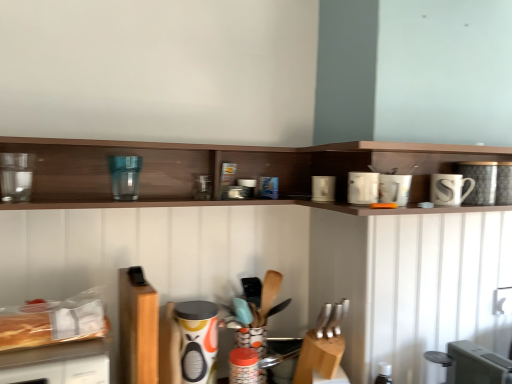
The image size is (512, 384). What do you see at coordinates (248, 186) in the screenshot?
I see `metallic silver toaster at upper center, the 6th appliance when ordered from right to left` at bounding box center [248, 186].

Identify the location of translucent plastic bread at lower left. This screenshot has height=384, width=512. (53, 321).

What do you see at coordinates (53, 321) in the screenshot? I see `translucent plastic bread at lower left` at bounding box center [53, 321].

Describe the element at coordinates (394, 189) in the screenshot. I see `white ceramic mug at upper right, the third appliance in the right-to-left sequence` at that location.

At what (x,y) coordinates should I click in order to perform the action: click on transparent glassware at upper center. Please return your answer as a coordinate pair (x, y). Looking at the image, I should click on (237, 171).

Locate an element on the screen. The image size is (512, 384). white ceramic mug at upper right, positioned as the first appliance in right-to-left order is located at coordinates (480, 181).

Can we say white ceramic mug at upper right, the 8th appliance positioned from the left, lies outside transparent glassware at upper center?

Yes, white ceramic mug at upper right, the 8th appliance positioned from the left, is located beyond the bounds of transparent glassware at upper center.

From the picture: Which is closer, [389,183] or [346,174]?

Point [389,183] appears to be closer to the viewer than point [346,174].

From a real-world perspective, which object rests below the other?

white ceramic mug at upper right, the third appliance in the right-to-left sequence, from a real-world perspective.

Is white ceramic mug at upper right facing away from white glossy toaster at upper right, arranged as the sixth appliance when viewed from the left?

white ceramic mug at upper right is not turned away from white glossy toaster at upper right, arranged as the sixth appliance when viewed from the left.

Which of these two, white ceramic mug at upper right or white glossy toaster at upper right, arranged as the sixth appliance when viewed from the left, is smaller?

white glossy toaster at upper right, arranged as the sixth appliance when viewed from the left, is smaller.

How much distance is there between white ceramic mug at upper right and white glossy toaster at upper right, arranged as the sixth appliance when viewed from the left?

white ceramic mug at upper right and white glossy toaster at upper right, arranged as the sixth appliance when viewed from the left, are 12.64 inches apart.

Are white ceramic mug at upper right and white glossy toaster at upper right, marked as the 5th appliance in a right-to-left arrangement, far apart?

No, white ceramic mug at upper right is not far away from white glossy toaster at upper right, marked as the 5th appliance in a right-to-left arrangement.

From the image's perspective, which is below, white ceramic mug at upper right or transparent glass water filter at upper left, placed as the second appliance when sorted from left to right?

white ceramic mug at upper right.

Considering the positions of objects white ceramic mug at upper right and transparent glass water filter at upper left, which appears as the ninth appliance when viewed from the right, in the image provided, who is in front, white ceramic mug at upper right or transparent glass water filter at upper left, which appears as the ninth appliance when viewed from the right,?

white ceramic mug at upper right is more forward.

Who is shorter, white ceramic mug at upper right or transparent glass water filter at upper left, placed as the second appliance when sorted from left to right?

With less height is white ceramic mug at upper right.

Is white ceramic mug at upper right bigger or smaller than transparent glass water filter at upper left, placed as the second appliance when sorted from left to right?

Considering their sizes, white ceramic mug at upper right takes up more space than transparent glass water filter at upper left, placed as the second appliance when sorted from left to right.

Is point (318, 188) behind point (9, 193)?

Yes.

Which of these two, white glossy toaster at upper right, arranged as the sixth appliance when viewed from the left, or transparent glass at upper left, positioned as the first appliance in left-to-right order, is wider?

white glossy toaster at upper right, arranged as the sixth appliance when viewed from the left.

Does white glossy toaster at upper right, arranged as the sixth appliance when viewed from the left, appear on the left side of transparent glass at upper left, positioned as the first appliance in left-to-right order?

No.

Choose the correct answer: Is white glossy toaster at upper right, arranged as the sixth appliance when viewed from the left, inside transparent glass at upper left, positioned as the first appliance in left-to-right order, or outside it?

white glossy toaster at upper right, arranged as the sixth appliance when viewed from the left, cannot be found inside transparent glass at upper left, positioned as the first appliance in left-to-right order.

Is point (1, 176) positioned in front of point (279, 184)?

Yes, point (1, 176) is in front of point (279, 184).

Between transparent glass at upper left, positioned as the first appliance in left-to-right order, and transparent glassware at upper center, which one has more height?

With more height is transparent glassware at upper center.

Which is more to the right, transparent glass at upper left, positioned as the first appliance in left-to-right order, or transparent glassware at upper center?

transparent glassware at upper center is more to the right.

Based on the photo, is transparent glass at upper left, positioned as the first appliance in left-to-right order, touching transparent glassware at upper center?

transparent glass at upper left, positioned as the first appliance in left-to-right order, is not next to transparent glassware at upper center, and they're not touching.

Consider the image. Do you think matte plastic container at center, the eighth appliance viewed from the right, is within wooden spoon at center, which ranks as the 1th silverware in left-to-right order, or outside of it?

matte plastic container at center, the eighth appliance viewed from the right, is not inside wooden spoon at center, which ranks as the 1th silverware in left-to-right order, it's outside.

Locate an element on the screen. silverware that is the 2nd one above the matte plastic container at center, the 3th appliance from the left (from a real-world perspective) is located at coordinates pyautogui.click(x=267, y=297).

Is matte plastic container at center, the eighth appliance viewed from the right, far from wooden spoon at center, which ranks as the 1th silverware in left-to-right order?

No.

Find the location of a particular element. This screenshot has height=384, width=512. the 6th appliance to the left when counting from the silver metallic knives at center, which appears as the 1th silverware when viewed from the front is located at coordinates (16, 176).

Considering the sizes of objects transparent glass at upper left, placed as the tenth appliance when sorted from right to left, and silver metallic knives at center, the 1th silverware viewed from the right, in the image provided, who is thinner, transparent glass at upper left, placed as the tenth appliance when sorted from right to left, or silver metallic knives at center, the 1th silverware viewed from the right,?

transparent glass at upper left, placed as the tenth appliance when sorted from right to left.

Can you see transparent glass at upper left, positioned as the first appliance in left-to-right order, touching silver metallic knives at center, which is the 2th silverware from back to front?

No, transparent glass at upper left, positioned as the first appliance in left-to-right order, is not next to silver metallic knives at center, which is the 2th silverware from back to front.

Which point is more forward, (17, 191) or (338, 316)?

The point (17, 191) is closer to the camera.

Identify the location of the 6th appliance positioned below the transparent glassware at upper center (from the image's perspective). The height and width of the screenshot is (384, 512). (394, 189).

From a real-world perspective, count 1st appliances downward from the white ceramic mug at upper right and point to it. Please provide its 2D coordinates.

[(323, 188)]

Which object lies nearer to the anchor point white ceramic mug at upper right, the 8th appliance positioned from the left, wooden spoon at center, the 2th silverware viewed from the front, or transparent glass at upper left, placed as the tenth appliance when sorted from right to left?

The object closer to white ceramic mug at upper right, the 8th appliance positioned from the left, is wooden spoon at center, the 2th silverware viewed from the front.

In the scene shown: From the image, which object appears to be nearer to wooden spoon at center, which is counted as the 2th silverware, starting from the right, transparent glassware at upper center or white ceramic mug at upper right?

transparent glassware at upper center lies closer to wooden spoon at center, which is counted as the 2th silverware, starting from the right, than the other object.

Looking at this image, based on their spatial positions, is transparent glass at upper left, placed as the tenth appliance when sorted from right to left, or metallic silver toaster at lower right, the ninth appliance when ordered from left to right, further from white ceramic mug at upper right?

The object further to white ceramic mug at upper right is transparent glass at upper left, placed as the tenth appliance when sorted from right to left.

From the image, which object appears to be nearer to white ceramic mug at upper right, the third appliance in the right-to-left sequence, metallic silver toaster at lower right, the 2th appliance positioned from the right, or white glossy toaster at upper right, marked as the 5th appliance in a right-to-left arrangement?

Based on the image, white glossy toaster at upper right, marked as the 5th appliance in a right-to-left arrangement, appears to be nearer to white ceramic mug at upper right, the third appliance in the right-to-left sequence.

In the scene shown: Considering their positions, is transparent glassware at upper center positioned further to white glossy coffee cup at upper right, which is the fourth appliance in right-to-left order, than wooden spoon at center, the 2th silverware viewed from the front?

Based on the image, wooden spoon at center, the 2th silverware viewed from the front, appears to be further to white glossy coffee cup at upper right, which is the fourth appliance in right-to-left order.

Based on their spatial positions, is matte plastic container at center, the 3th appliance from the left, or white glossy coffee cup at upper right, the seventh appliance from the left, closer to wooden spoon at center, which is counted as the 2th silverware, starting from the right?

Based on the image, matte plastic container at center, the 3th appliance from the left, appears to be nearer to wooden spoon at center, which is counted as the 2th silverware, starting from the right.

Considering their positions, is metallic silver toaster at lower right, the 2th appliance positioned from the right, positioned further to white glossy coffee cup at upper right, the seventh appliance from the left, than translucent plastic bread at lower left?

Based on the image, translucent plastic bread at lower left appears to be further to white glossy coffee cup at upper right, the seventh appliance from the left.

When comparing their distances from metallic silver toaster at lower right, the ninth appliance when ordered from left to right, does metallic silver toaster at center, which ranks as the 4th appliance in left-to-right order, or transparent glass at upper left, placed as the tenth appliance when sorted from right to left, seem closer?

Among the two, metallic silver toaster at center, which ranks as the 4th appliance in left-to-right order, is located nearer to metallic silver toaster at lower right, the ninth appliance when ordered from left to right.

At what (x,y) coordinates should I click in order to perform the action: click on mug between metallic silver toaster at upper center, the 6th appliance when ordered from right to left, and white ceramic mug at upper right, arranged as the 10th appliance when viewed from the left, from left to right. Please return your answer as a coordinate pair (x, y). Looking at the image, I should click on (449, 189).

At what (x,y) coordinates should I click in order to perform the action: click on food between transparent glassware at upper center and metallic silver toaster at upper center, which appears as the fifth appliance when viewed from the left, in the front-back direction. Please return your answer as a coordinate pair (x, y). This screenshot has height=384, width=512. Looking at the image, I should click on (53, 321).

Where is `shelf between translucent plastic bread at lower left and white glossy coffee cup at upper right, which is the fourth appliance in right-to-left order`? This screenshot has width=512, height=384. shelf between translucent plastic bread at lower left and white glossy coffee cup at upper right, which is the fourth appliance in right-to-left order is located at coordinates (237, 171).

In order to click on mug located between white ceramic mug at upper right, the third appliance in the right-to-left sequence, and white ceramic mug at upper right, arranged as the 10th appliance when viewed from the left, in the left-right direction in this screenshot , I will do `click(449, 189)`.